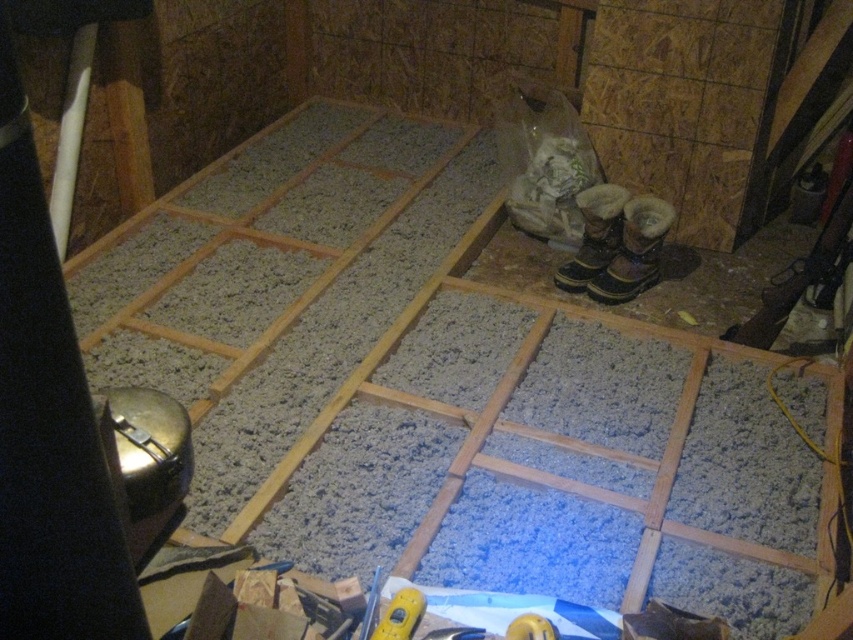
Question: Does yellow plastic tape measure at lower center have a larger size compared to yellow plastic tool at lower center?

Choices:
 (A) yes
 (B) no

Answer: (A)

Question: Is brown suede boot at center closer to camera compared to yellow plastic tape measure at lower center?

Choices:
 (A) yes
 (B) no

Answer: (B)

Question: Which point is closer to the camera?

Choices:
 (A) brown suede boot at center
 (B) brown leather boot at right

Answer: (B)

Question: Which point appears closest to the camera in this image?

Choices:
 (A) (558, 276)
 (B) (515, 628)

Answer: (B)

Question: Is brown suede boot at center positioned behind yellow plastic tape measure at lower center?

Choices:
 (A) no
 (B) yes

Answer: (B)

Question: Estimate the real-world distances between objects in this image. Which object is closer to the brown suede boot at center?

Choices:
 (A) yellow plastic tool at lower center
 (B) yellow plastic tape measure at lower center
 (C) brown leather boot at right

Answer: (C)